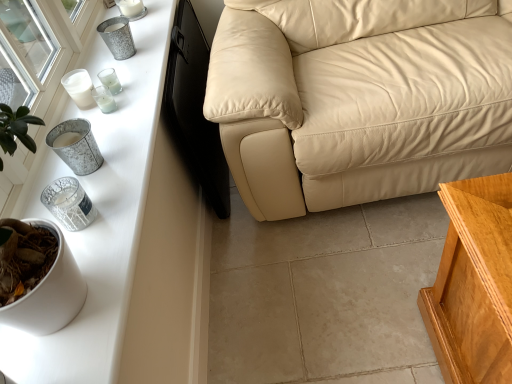
At what (x,y) coordinates should I click in order to perform the action: click on free space in front of metallic glass candle holder at upper left, which is the second candle holder from top to bottom. Please return your answer as a coordinate pair (x, y). Looking at the image, I should click on (118, 125).